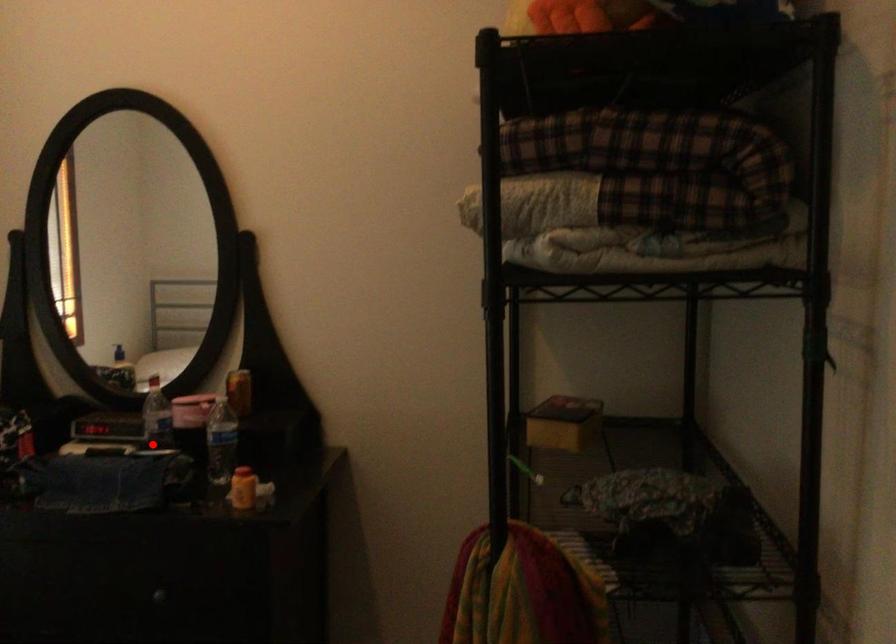
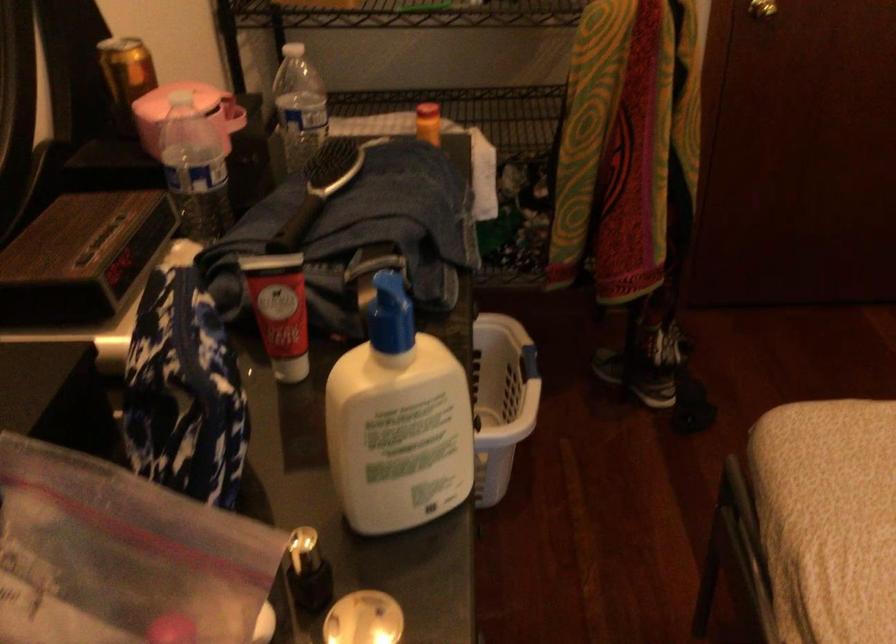
Locate, in the second image, the point that corresponds to the highlighted location in the first image.

(337, 164)